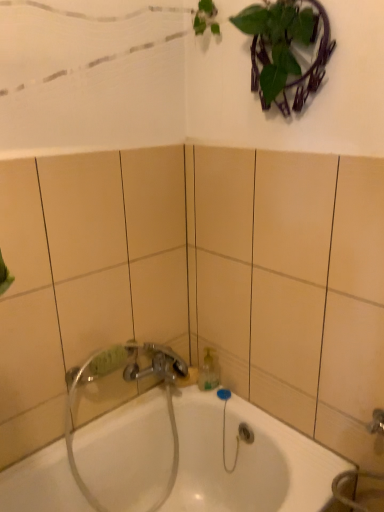
Question: Is clear plastic hose at lower center situated inside white glossy bathtub at center or outside?

Choices:
 (A) inside
 (B) outside

Answer: (A)

Question: Considering the positions of clear plastic hose at lower center and white glossy bathtub at center in the image, is clear plastic hose at lower center wider or thinner than white glossy bathtub at center?

Choices:
 (A) thin
 (B) wide

Answer: (A)

Question: Considering their positions, is clear plastic hose at lower center located in front of or behind white glossy bathtub at center?

Choices:
 (A) behind
 (B) front

Answer: (A)

Question: From the image's perspective, is white glossy bathtub at center above or below clear plastic hose at lower center?

Choices:
 (A) below
 (B) above

Answer: (A)

Question: Does point (223, 503) appear closer or farther from the camera than point (125, 369)?

Choices:
 (A) closer
 (B) farther

Answer: (B)

Question: Is white glossy bathtub at center in front of or behind clear plastic hose at lower center in the image?

Choices:
 (A) behind
 (B) front

Answer: (B)

Question: Is white glossy bathtub at center spatially inside clear plastic hose at lower center, or outside of it?

Choices:
 (A) inside
 (B) outside

Answer: (B)